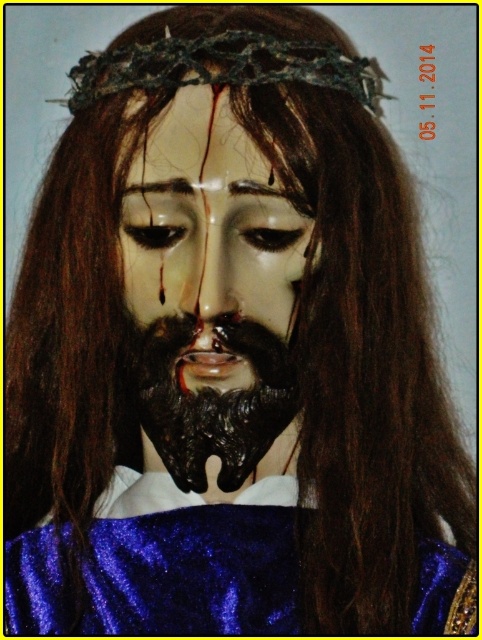
Is black matte beard at center above glossy wax forehead at center?

Incorrect, black matte beard at center is not positioned above glossy wax forehead at center.

Image resolution: width=482 pixels, height=640 pixels. I want to click on black matte beard at center, so click(x=210, y=400).

Can you confirm if blue glittery robe at center is taller than glossy wax forehead at center?

Correct, blue glittery robe at center is much taller as glossy wax forehead at center.

Does blue glittery robe at center come behind glossy wax forehead at center?

Yes, it is behind glossy wax forehead at center.

Where is `blue glittery robe at center`? Image resolution: width=482 pixels, height=640 pixels. blue glittery robe at center is located at coordinates (192, 561).

What are the coordinates of `blue glittery robe at center` in the screenshot? It's located at (192, 561).

Is point (295, 630) positioned before point (232, 128)?

No, (295, 630) is behind (232, 128).

Who is more forward, (146,516) or (204,234)?

Positioned in front is point (204,234).

Is point (44, 616) less distant than point (138, 221)?

No, (44, 616) is behind (138, 221).

The width and height of the screenshot is (482, 640). Find the location of `blue glittery robe at center`. blue glittery robe at center is located at coordinates (192, 561).